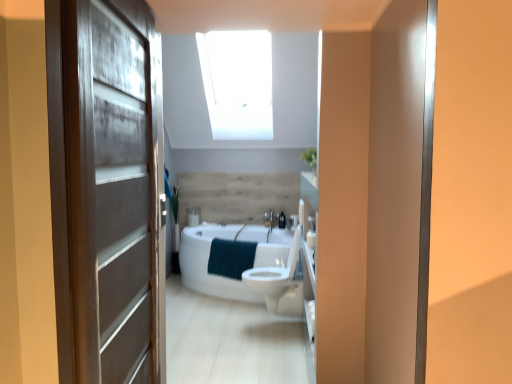
Question: Looking at the image, does matte brown door at left seem bigger or smaller compared to teal soft towel at center?

Choices:
 (A) big
 (B) small

Answer: (A)

Question: From a real-world perspective, relative to teal soft towel at center, is matte brown door at left vertically above or below?

Choices:
 (A) above
 (B) below

Answer: (A)

Question: Based on their relative distances, which object is nearer to the white glossy bathtub at center?

Choices:
 (A) white glossy toilet at center
 (B) teal soft towel at center
 (C) matte black soap dispenser at center
 (D) white matte toilet paper at right
 (E) matte brown door at left

Answer: (B)

Question: Which object is the closest to the white glossy bathtub at center?

Choices:
 (A) teal soft towel at center
 (B) matte brown door at left
 (C) white glossy toilet at center
 (D) white matte toilet paper at right
 (E) matte black soap dispenser at center

Answer: (A)